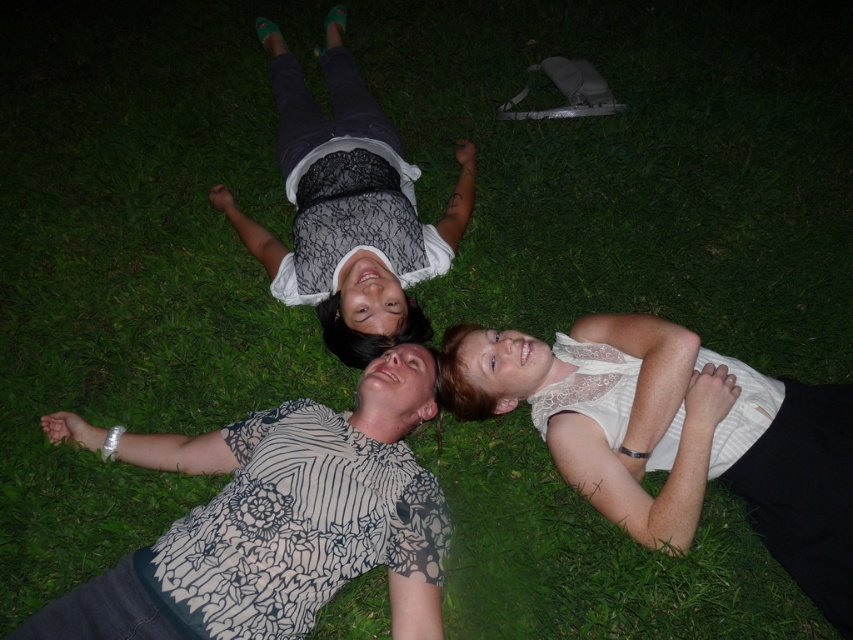
Question: Which object appears closest to the camera in this image?

Choices:
 (A) white lace tank top at center
 (B) matte black shirt at upper center
 (C) white lace shirt at center

Answer: (C)

Question: Is white lace shirt at center wider than white lace tank top at center?

Choices:
 (A) no
 (B) yes

Answer: (B)

Question: Does white lace shirt at center have a larger size compared to white lace tank top at center?

Choices:
 (A) no
 (B) yes

Answer: (B)

Question: From the image, what is the correct spatial relationship of white lace shirt at center in relation to matte black shirt at upper center?

Choices:
 (A) left
 (B) right

Answer: (A)

Question: Estimate the real-world distances between objects in this image. Which object is farther from the white lace shirt at center?

Choices:
 (A) white lace tank top at center
 (B) matte black shirt at upper center

Answer: (B)

Question: Considering the real-world distances, which object is closest to the white lace tank top at center?

Choices:
 (A) white lace shirt at center
 (B) matte black shirt at upper center

Answer: (A)